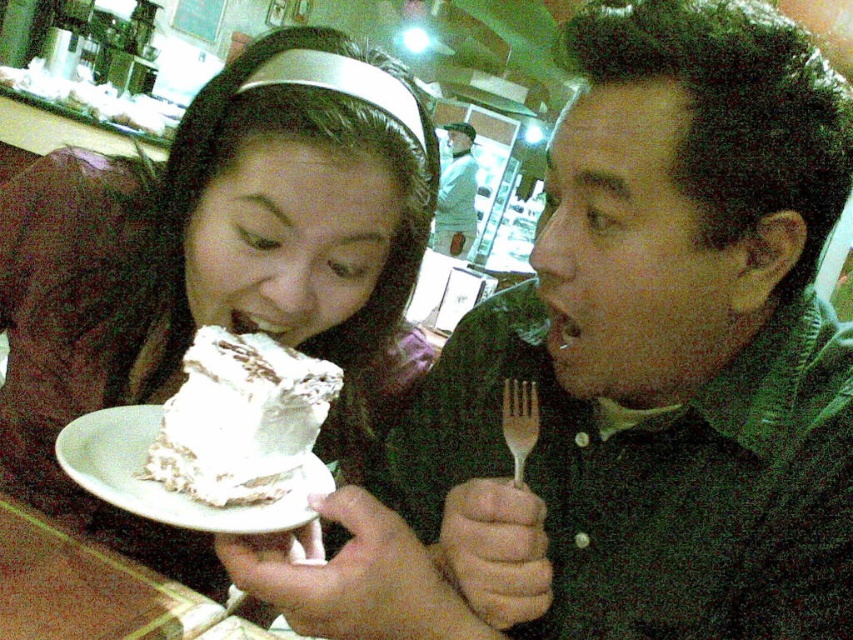
Is white frosted cake at center thinner than wooden fork at center?

Incorrect, white frosted cake at center's width is not less than wooden fork at center's.

Where is `white frosted cake at center`? This screenshot has width=853, height=640. white frosted cake at center is located at coordinates (241, 419).

Does matte white cake at left lie behind light blue fabric shirt at center?

That is False.

Between matte white cake at left and light blue fabric shirt at center, which one appears on the right side from the viewer's perspective?

light blue fabric shirt at center is more to the right.

At what (x,y) coordinates should I click in order to perform the action: click on matte white cake at left. Please return your answer as a coordinate pair (x, y). Looking at the image, I should click on [212, 272].

Where is `matte white cake at left`? This screenshot has width=853, height=640. matte white cake at left is located at coordinates (212, 272).

Is matte white cake at left taller than white frosted cake at center?

Indeed, matte white cake at left has a greater height compared to white frosted cake at center.

This screenshot has width=853, height=640. In order to click on matte white cake at left in this screenshot , I will do `click(212, 272)`.